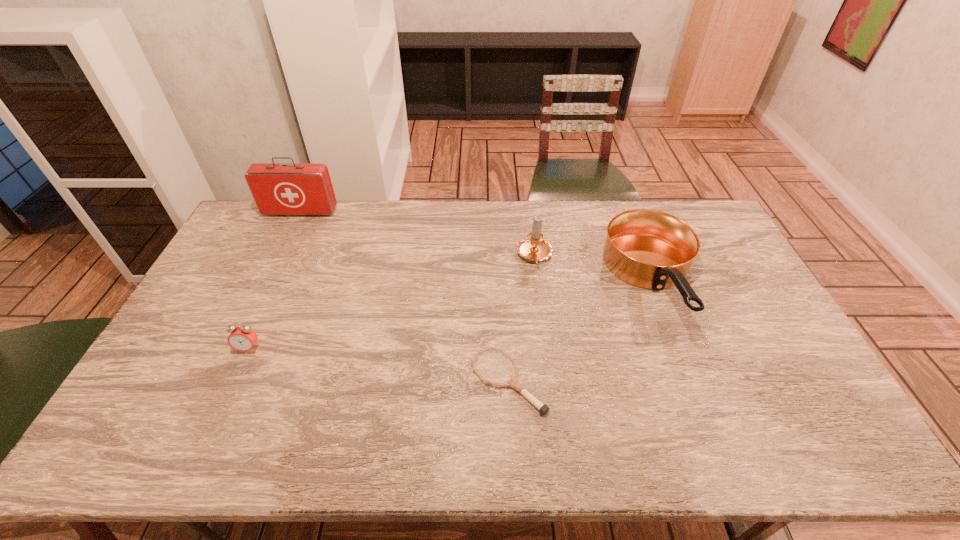
Find the location of `vacant space located 0.220m on the back of the shortest object`. vacant space located 0.220m on the back of the shortest object is located at coordinates (503, 293).

Locate an element on the screen. This screenshot has height=540, width=960. the first-aid kit that is at the far edge is located at coordinates (293, 188).

You are a GUI agent. You are given a task and a screenshot of the screen. Output one action in this format:
    pyautogui.click(x=<x>, y=<y>)
    Task: Click on the frying pan at the far edge
    Image resolution: width=960 pixels, height=540 pixels.
    Given the screenshot: What is the action you would take?
    pyautogui.click(x=650, y=249)

This screenshot has height=540, width=960. What are the coordinates of `object present at the left edge` in the screenshot? It's located at (293, 188).

The width and height of the screenshot is (960, 540). In order to click on object present at the far left corner in this screenshot , I will do `click(293, 188)`.

Locate an element on the screen. vacant space at the far edge is located at coordinates (368, 220).

At what (x,y) coordinates should I click in order to perform the action: click on vacant space at the near edge of the desktop. Please return your answer as a coordinate pair (x, y). Looking at the image, I should click on (607, 429).

I want to click on free space at the left edge of the desktop, so coord(234,285).

You are a GUI agent. You are given a task and a screenshot of the screen. Output one action in this format:
    pyautogui.click(x=<x>, y=<y>)
    Task: Click on the free space at the right edge of the desktop
    
    Given the screenshot: What is the action you would take?
    pyautogui.click(x=750, y=280)

Find the location of a particular element. The image size is (960, 540). vacant space at the near left corner of the desktop is located at coordinates (108, 457).